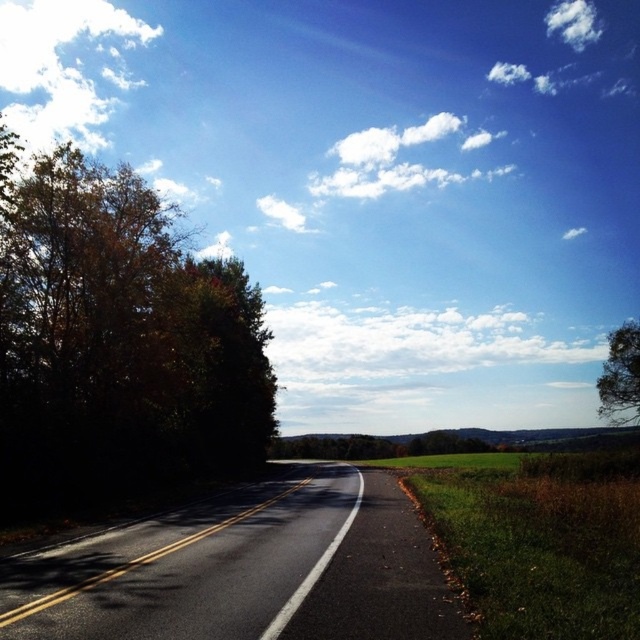
Question: Considering the relative positions of green leafy tree at left and green leafy tree at right in the image provided, where is green leafy tree at left located with respect to green leafy tree at right?

Choices:
 (A) below
 (B) above

Answer: (B)

Question: Which point appears farthest from the camera in this image?

Choices:
 (A) (179, 369)
 (B) (632, 412)
 (C) (176, 524)

Answer: (B)

Question: Does black asphalt road at center come behind green leafy tree at right?

Choices:
 (A) no
 (B) yes

Answer: (A)

Question: Which object is closer to the camera taking this photo?

Choices:
 (A) black asphalt road at center
 (B) green leafy tree at right
 (C) green leafy tree at left

Answer: (A)

Question: Can you confirm if green leafy tree at left is thinner than green leafy tree at right?

Choices:
 (A) no
 (B) yes

Answer: (B)

Question: Which is farther from the green leafy tree at left?

Choices:
 (A) black asphalt road at center
 (B) green leafy tree at right

Answer: (B)